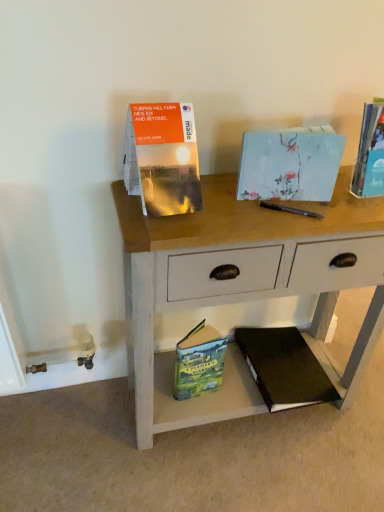
Locate an element on the screen. This screenshot has width=384, height=512. vacant space situated on the left part of light blue paper at center, the 4th paperback book from the bottom is located at coordinates (220, 198).